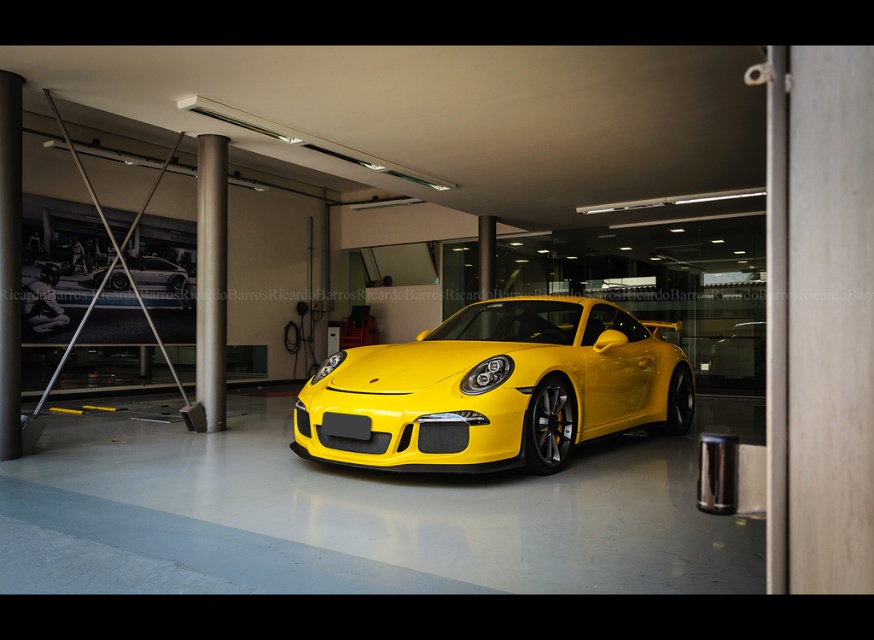
Question: Which point is farther from the camera taking this photo?

Choices:
 (A) (205, 317)
 (B) (621, 328)
 (C) (167, 268)

Answer: (C)

Question: Does glossy yellow sports car at center appear on the left side of yellow glossy sports car at center?

Choices:
 (A) yes
 (B) no

Answer: (B)

Question: Does glossy yellow sports car at center appear on the left side of yellow glossy sports car at center?

Choices:
 (A) yes
 (B) no

Answer: (B)

Question: Where is glossy yellow sports car at center located in relation to yellow glossy sports car at center in the image?

Choices:
 (A) left
 (B) right

Answer: (B)

Question: Among these objects, which one is farthest from the camera?

Choices:
 (A) yellow glossy sports car at center
 (B) glossy yellow sports car at center

Answer: (A)

Question: Which of the following is the closest to the observer?

Choices:
 (A) (205, 260)
 (B) (156, 266)
 (C) (494, 388)

Answer: (C)